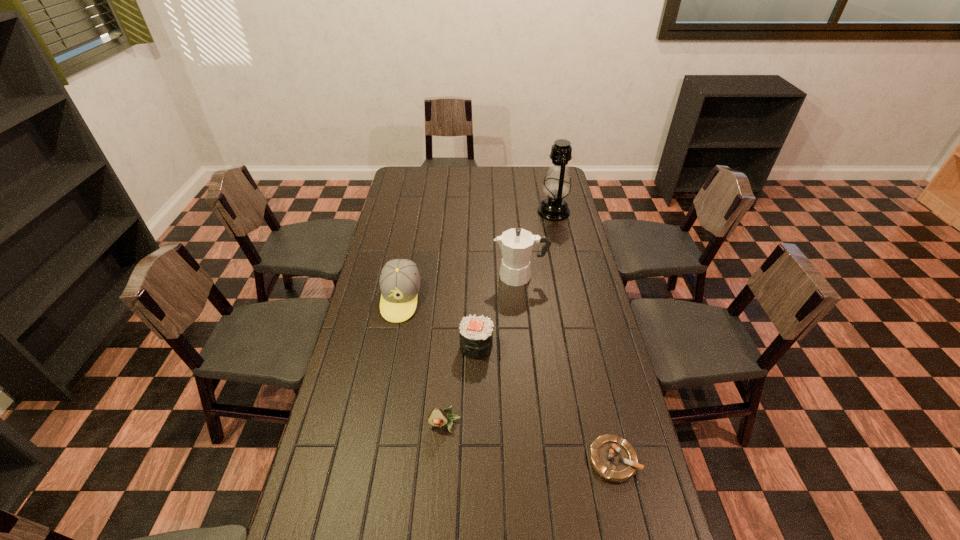
Locate an element on the screen. ashtray positioned at the right edge is located at coordinates (613, 458).

I want to click on vacant area at the far edge of the desktop, so click(476, 170).

In the image, there is a desktop. Where is `vacant space at the left edge`? vacant space at the left edge is located at coordinates (400, 247).

Identify the location of free location at the right edge of the desktop. The image size is (960, 540). (598, 410).

This screenshot has width=960, height=540. What are the coordinates of `vacant area that lies between the coffeepot and the baseball cap` in the screenshot? It's located at (461, 287).

The height and width of the screenshot is (540, 960). Identify the location of free point between the coffeepot and the fourth shortest object. (461, 287).

Find the location of a particular element. The height and width of the screenshot is (540, 960). free spot between the sushi and the second nearest object is located at coordinates (461, 386).

At what (x,y) coordinates should I click in order to perform the action: click on unoccupied position between the tallest object and the shortest object. Please return your answer as a coordinate pair (x, y). The height and width of the screenshot is (540, 960). Looking at the image, I should click on (584, 336).

Identify the location of free spot between the second tallest object and the sushi. 498,311.

You are a GUI agent. You are given a task and a screenshot of the screen. Output one action in this format:
    pyautogui.click(x=<x>, y=<y>)
    Task: Click on the free spot between the fifth shortest object and the third nearest object
    The image size is (960, 540).
    Given the screenshot: What is the action you would take?
    pyautogui.click(x=498, y=311)